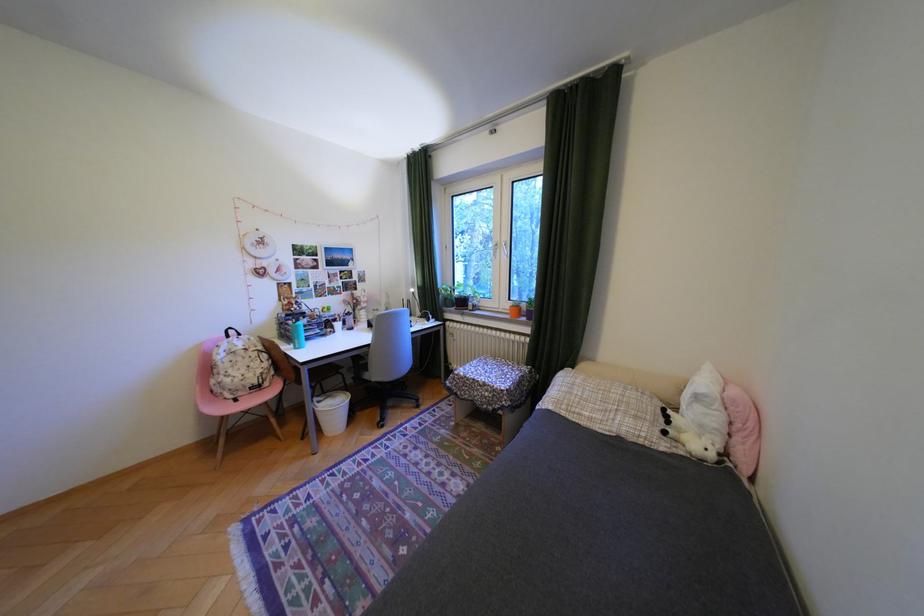
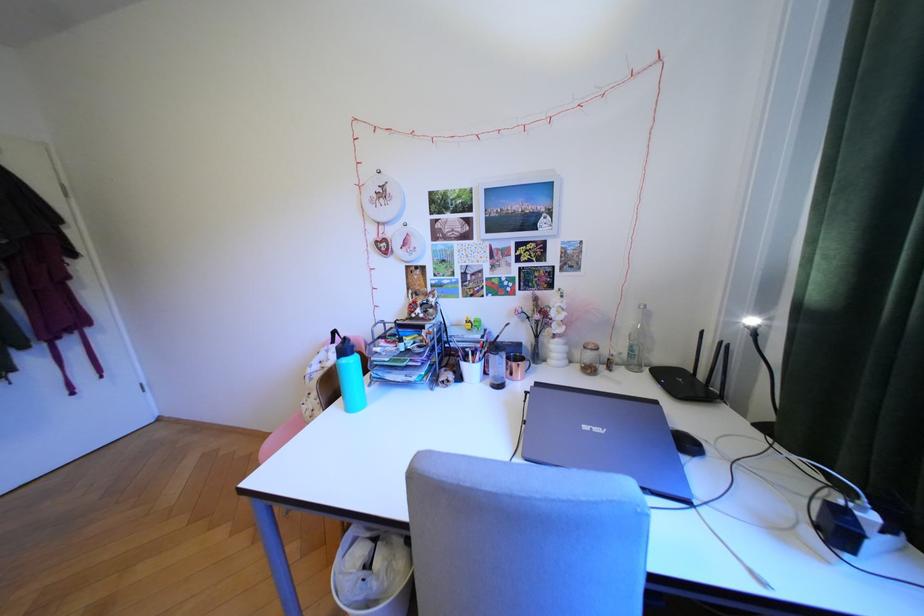
Where in the second image is the point corresponding to point (238, 331) from the first image?

(345, 334)